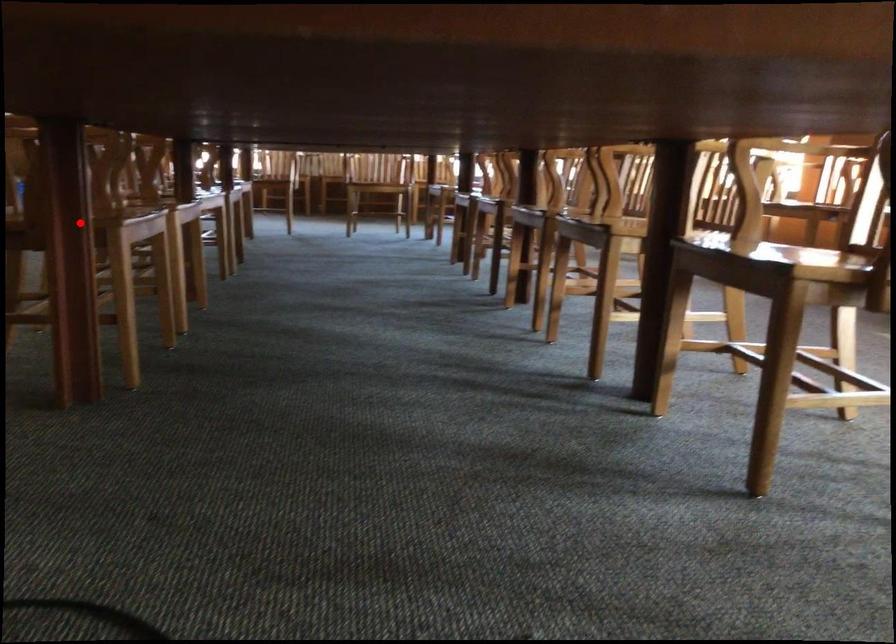
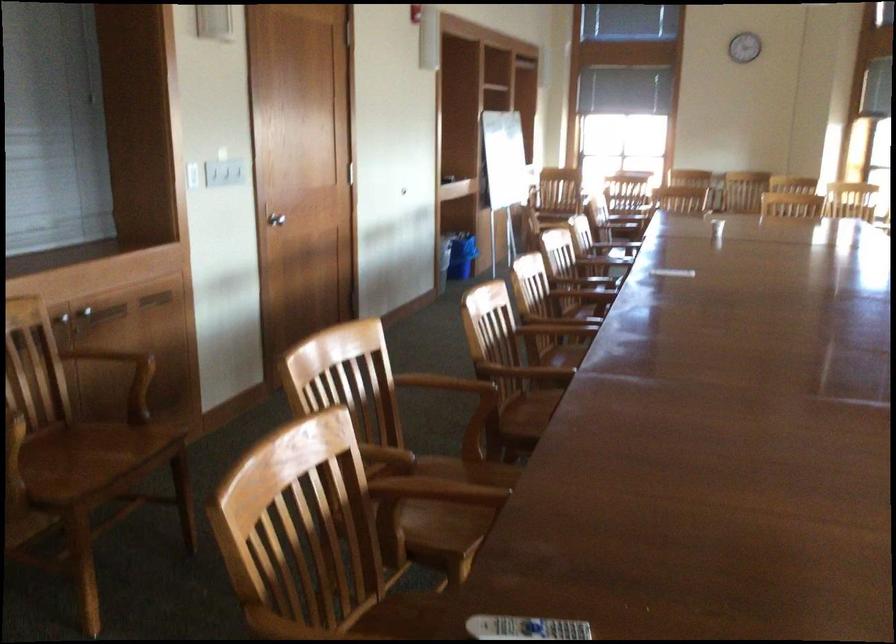
Question: I am providing you with two images of the same scene from different viewpoints. A red point is marked on the first image. At the location where the point appears in image 1, is it still visible in image 2?

Choices:
 (A) Yes
 (B) No

Answer: (B)